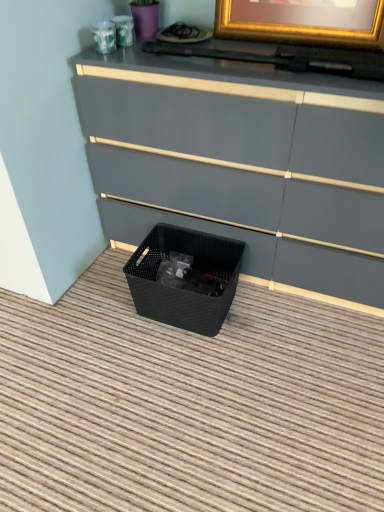
Question: Is matte black storage bin at lower left bigger than black woven basket at lower center?

Choices:
 (A) no
 (B) yes

Answer: (B)

Question: Is matte black storage bin at lower left at the left side of black woven basket at lower center?

Choices:
 (A) yes
 (B) no

Answer: (B)

Question: Considering the relative sizes of matte black storage bin at lower left and black woven basket at lower center in the image provided, is matte black storage bin at lower left shorter than black woven basket at lower center?

Choices:
 (A) no
 (B) yes

Answer: (A)

Question: Is matte black storage bin at lower left positioned with its back to black woven basket at lower center?

Choices:
 (A) yes
 (B) no

Answer: (B)

Question: Considering the relative sizes of matte black storage bin at lower left and black woven basket at lower center in the image provided, is matte black storage bin at lower left wider than black woven basket at lower center?

Choices:
 (A) no
 (B) yes

Answer: (B)

Question: Is matte black storage bin at lower left thinner than black woven basket at lower center?

Choices:
 (A) no
 (B) yes

Answer: (A)

Question: Is black woven basket at lower center facing away from matte black storage bin at lower left?

Choices:
 (A) yes
 (B) no

Answer: (A)

Question: From the image's perspective, is black woven basket at lower center on matte black storage bin at lower left?

Choices:
 (A) no
 (B) yes

Answer: (A)

Question: Does black woven basket at lower center contain matte black storage bin at lower left?

Choices:
 (A) no
 (B) yes

Answer: (A)

Question: Is black woven basket at lower center touching matte black storage bin at lower left?

Choices:
 (A) no
 (B) yes

Answer: (A)

Question: Is the position of black woven basket at lower center more distant than that of matte black storage bin at lower left?

Choices:
 (A) yes
 (B) no

Answer: (A)

Question: Would you consider black woven basket at lower center to be distant from matte black storage bin at lower left?

Choices:
 (A) yes
 (B) no

Answer: (B)

Question: In the image, is black woven basket at lower center positioned in front of or behind matte black storage bin at lower left?

Choices:
 (A) front
 (B) behind

Answer: (B)